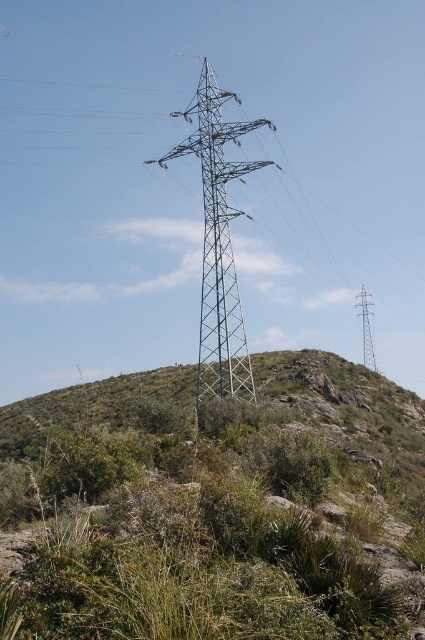
Question: Can you confirm if green grassy shrubs at center is smaller than metallic silver tower at center?

Choices:
 (A) no
 (B) yes

Answer: (B)

Question: Among these points, which one is nearest to the camera?

Choices:
 (A) (363, 346)
 (B) (218, 136)

Answer: (B)

Question: Which point is closer to the camera taking this photo?

Choices:
 (A) (206, 358)
 (B) (371, 365)

Answer: (A)

Question: Is green grassy shrubs at center behind metallic silver tower at center?

Choices:
 (A) yes
 (B) no

Answer: (B)

Question: Does green grassy shrubs at center appear over metallic silver tower at center?

Choices:
 (A) no
 (B) yes

Answer: (A)

Question: Which point appears closest to the camera in this image?

Choices:
 (A) (244, 387)
 (B) (348, 609)
 (C) (368, 337)

Answer: (B)